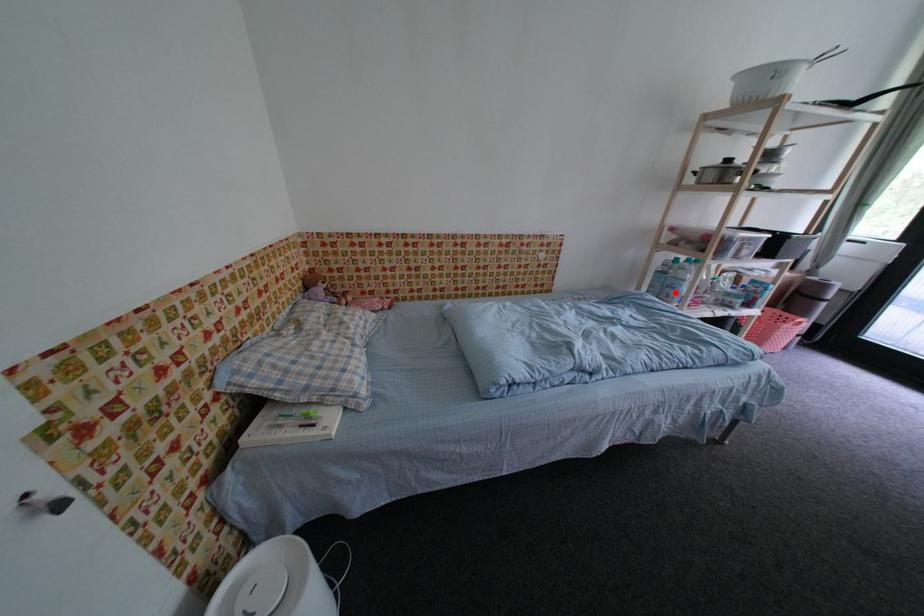
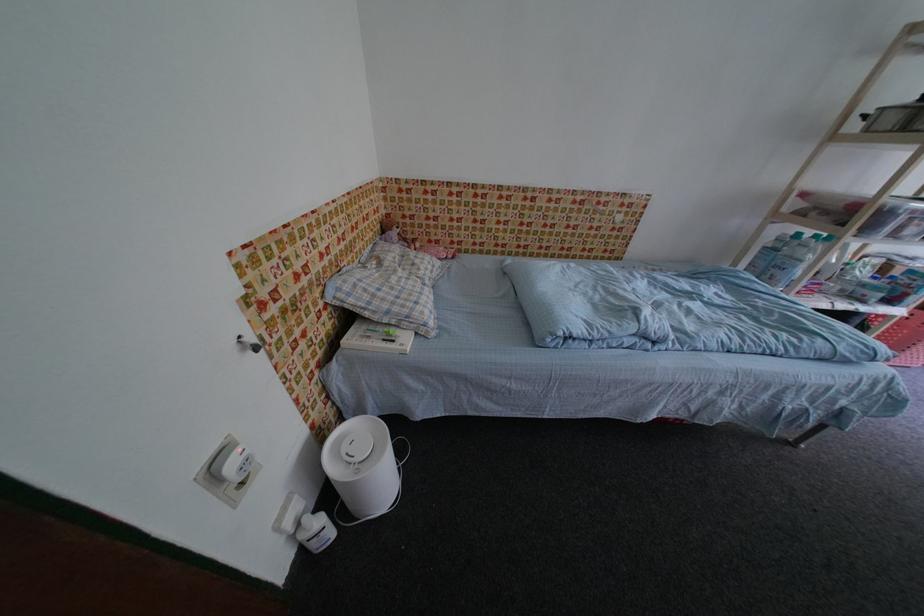
The point at the highlighted location is marked in the first image. Where is the corresponding point in the second image?

(782, 274)